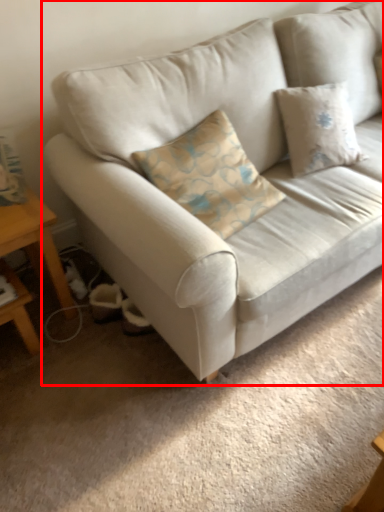
Question: In this image, where is studio couch (annotated by the red box) located relative to table?

Choices:
 (A) left
 (B) right

Answer: (B)